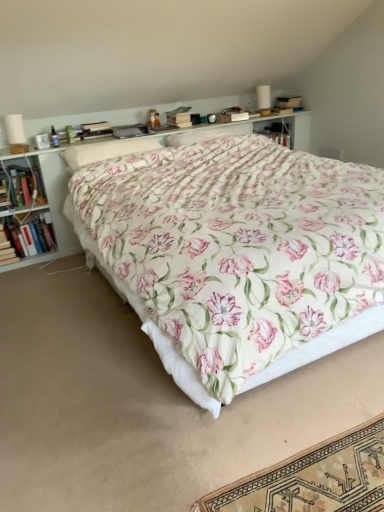
What do you see at coordinates (107, 150) in the screenshot?
I see `floral fabric pillow at center, which ranks as the 1th pillow in left-to-right order` at bounding box center [107, 150].

Identify the location of hardcover book at left, arranged as the second book when viewed from the top. (34, 236).

Image resolution: width=384 pixels, height=512 pixels. What do you see at coordinates (205, 134) in the screenshot?
I see `floral fabric pillow at center, which ranks as the second pillow in left-to-right order` at bounding box center [205, 134].

Find the location of a particular element. The height and width of the screenshot is (512, 384). floral cotton bed at center is located at coordinates (237, 255).

Is hardcover book at left, the 3th book positioned from the bottom, in front of or behind white wood shelf at upper center in the image?

Visually, hardcover book at left, the 3th book positioned from the bottom, is located behind white wood shelf at upper center.

Is point (19, 173) behind point (43, 175)?

No, (19, 173) is closer to viewer.

Who is taller, hardcover book at left, the 3th book positioned from the bottom, or white wood shelf at upper center?

Standing taller between the two is white wood shelf at upper center.

The height and width of the screenshot is (512, 384). What are the coordinates of `shelf on the right of hardcover book at left, which ranks as the first book in top-to-bottom order` in the screenshot? It's located at (54, 206).

In the scene shown: Could you tell me if floral fabric pillow at center, which is the 1th pillow from right to left, is facing hardcover book at left, the 3th book positioned from the bottom?

No, floral fabric pillow at center, which is the 1th pillow from right to left, is not facing towards hardcover book at left, the 3th book positioned from the bottom.

Is there a large distance between floral fabric pillow at center, which is the 1th pillow from right to left, and hardcover book at left, which ranks as the first book in top-to-bottom order?

Absolutely, floral fabric pillow at center, which is the 1th pillow from right to left, is distant from hardcover book at left, which ranks as the first book in top-to-bottom order.

Between floral fabric pillow at center, which ranks as the second pillow in left-to-right order, and hardcover book at left, the 3th book positioned from the bottom, which one is positioned behind?

Positioned behind is floral fabric pillow at center, which ranks as the second pillow in left-to-right order.

Based on their sizes in the image, would you say floral fabric pillow at center, which is the 1th pillow from right to left, is bigger or smaller than hardcover book at left, which ranks as the first book in top-to-bottom order?

In the image, floral fabric pillow at center, which is the 1th pillow from right to left, appears to be larger than hardcover book at left, which ranks as the first book in top-to-bottom order.

Which is further, (10, 250) or (62, 201)?

Point (10, 250)

Would you say hardcover book at left, placed as the 3th book when sorted from top to bottom, contains white wood shelf at upper center?

That's incorrect, white wood shelf at upper center is not inside hardcover book at left, placed as the 3th book when sorted from top to bottom.

Is hardcover book at left, placed as the 3th book when sorted from top to bottom, further to camera compared to white wood shelf at upper center?

That is True.

From a real-world perspective, is hardcover book at left, placed as the 3th book when sorted from top to bottom, physically located above or below white wood shelf at upper center?

From a real-world perspective, hardcover book at left, placed as the 3th book when sorted from top to bottom, is physically below white wood shelf at upper center.

Looking at this image, considering the relative positions of floral cotton bed at center and white wood shelf at upper center in the image provided, is floral cotton bed at center to the right of white wood shelf at upper center from the viewer's perspective?

Correct, you'll find floral cotton bed at center to the right of white wood shelf at upper center.

Considering the sizes of objects floral cotton bed at center and white wood shelf at upper center in the image provided, who is bigger, floral cotton bed at center or white wood shelf at upper center?

Bigger between the two is floral cotton bed at center.

Does floral cotton bed at center come in front of white wood shelf at upper center?

Yes, it is.

From the picture: What's the angular difference between floral cotton bed at center and white wood shelf at upper center's facing directions?

floral cotton bed at center and white wood shelf at upper center are facing 0.000921 degrees away from each other.

Considering the positions of objects floral fabric pillow at center, positioned as the second pillow in right-to-left order, and floral fabric pillow at center, which ranks as the second pillow in left-to-right order, in the image provided, who is in front, floral fabric pillow at center, positioned as the second pillow in right-to-left order, or floral fabric pillow at center, which ranks as the second pillow in left-to-right order,?

floral fabric pillow at center, positioned as the second pillow in right-to-left order.

Does floral fabric pillow at center, which ranks as the 1th pillow in left-to-right order, have a smaller size compared to floral fabric pillow at center, which is the 1th pillow from right to left?

No.

In the scene shown: Does floral fabric pillow at center, which ranks as the 1th pillow in left-to-right order, appear on the left side of floral fabric pillow at center, which ranks as the second pillow in left-to-right order?

Indeed, floral fabric pillow at center, which ranks as the 1th pillow in left-to-right order, is positioned on the left side of floral fabric pillow at center, which ranks as the second pillow in left-to-right order.

Which object is wider, floral fabric pillow at center, which ranks as the 1th pillow in left-to-right order, or floral fabric pillow at center, which is the 1th pillow from right to left?

floral fabric pillow at center, which ranks as the 1th pillow in left-to-right order.

Visually, is hardcover book at left, arranged as the second book when viewed from the top, positioned to the left or to the right of floral fabric pillow at center, positioned as the second pillow in right-to-left order?

Clearly, hardcover book at left, arranged as the second book when viewed from the top, is on the left of floral fabric pillow at center, positioned as the second pillow in right-to-left order, in the image.

Where is `pillow that is the 1st one when counting rightward from the hardcover book at left, arranged as the 2th book when ordered from the bottom`? Image resolution: width=384 pixels, height=512 pixels. pillow that is the 1st one when counting rightward from the hardcover book at left, arranged as the 2th book when ordered from the bottom is located at coordinates (107, 150).

From a real-world perspective, is hardcover book at left, arranged as the second book when viewed from the top, on floral fabric pillow at center, positioned as the second pillow in right-to-left order?

No, from a real-world perspective, hardcover book at left, arranged as the second book when viewed from the top, is not over floral fabric pillow at center, positioned as the second pillow in right-to-left order

Do you think hardcover book at left, which ranks as the first book in top-to-bottom order, is within hardcover book at left, which is counted as the 1th book, starting from the bottom, or outside of it?

hardcover book at left, which ranks as the first book in top-to-bottom order, lies outside hardcover book at left, which is counted as the 1th book, starting from the bottom.

Between hardcover book at left, which ranks as the first book in top-to-bottom order, and hardcover book at left, which is counted as the 1th book, starting from the bottom, which one has more height?

hardcover book at left, which is counted as the 1th book, starting from the bottom, is taller.

From the image's perspective, would you say hardcover book at left, the 3th book positioned from the bottom, is shown under hardcover book at left, which is counted as the 1th book, starting from the bottom?

Incorrect, from the image's perspective, hardcover book at left, the 3th book positioned from the bottom, is higher than hardcover book at left, which is counted as the 1th book, starting from the bottom.

Looking at this image, would you consider hardcover book at left, which ranks as the first book in top-to-bottom order, to be distant from hardcover book at left, which is counted as the 1th book, starting from the bottom?

No, hardcover book at left, which ranks as the first book in top-to-bottom order, is not far away from hardcover book at left, which is counted as the 1th book, starting from the bottom.

The height and width of the screenshot is (512, 384). Identify the location of the 2nd book behind the white wood shelf at upper center, counting from the anchor's position. (23, 185).

Identify the location of the 2nd book counting from the left of the floral fabric pillow at center, which ranks as the second pillow in left-to-right order. This screenshot has height=512, width=384. (23, 185).

Which object lies further to the anchor point floral fabric pillow at center, which ranks as the second pillow in left-to-right order, white wood shelf at upper center or hardcover book at left, which is counted as the 1th book, starting from the bottom?

hardcover book at left, which is counted as the 1th book, starting from the bottom, is positioned further to the anchor floral fabric pillow at center, which ranks as the second pillow in left-to-right order.

Which object lies nearer to the anchor point floral cotton bed at center, hardcover book at left, which ranks as the first book in top-to-bottom order, or hardcover book at left, arranged as the second book when viewed from the top?

hardcover book at left, which ranks as the first book in top-to-bottom order, lies closer to floral cotton bed at center than the other object.

Based on their spatial positions, is hardcover book at left, which is counted as the 1th book, starting from the bottom, or white wood shelf at upper center further from hardcover book at left, the 3th book positioned from the bottom?

Based on the image, hardcover book at left, which is counted as the 1th book, starting from the bottom, appears to be further to hardcover book at left, the 3th book positioned from the bottom.

Estimate the real-world distances between objects in this image. Which object is further from floral cotton bed at center, hardcover book at left, which is counted as the 1th book, starting from the bottom, or floral fabric pillow at center, which is the 1th pillow from right to left?

hardcover book at left, which is counted as the 1th book, starting from the bottom, is further to floral cotton bed at center.

Looking at the image, which one is located further to white wood shelf at upper center, hardcover book at left, arranged as the 2th book when ordered from the bottom, or hardcover book at left, which is counted as the 1th book, starting from the bottom?

hardcover book at left, which is counted as the 1th book, starting from the bottom, lies further to white wood shelf at upper center than the other object.

Estimate the real-world distances between objects in this image. Which object is closer to hardcover book at left, arranged as the 2th book when ordered from the bottom, hardcover book at left, placed as the 3th book when sorted from top to bottom, or white wood shelf at upper center?

Among the two, hardcover book at left, placed as the 3th book when sorted from top to bottom, is located nearer to hardcover book at left, arranged as the 2th book when ordered from the bottom.

From the image, which object appears to be nearer to hardcover book at left, the 3th book positioned from the bottom, hardcover book at left, placed as the 3th book when sorted from top to bottom, or floral fabric pillow at center, positioned as the second pillow in right-to-left order?

The object closer to hardcover book at left, the 3th book positioned from the bottom, is hardcover book at left, placed as the 3th book when sorted from top to bottom.

Looking at the image, which one is located closer to floral fabric pillow at center, positioned as the second pillow in right-to-left order, white wood shelf at upper center or hardcover book at left, arranged as the 2th book when ordered from the bottom?

Based on the image, white wood shelf at upper center appears to be nearer to floral fabric pillow at center, positioned as the second pillow in right-to-left order.

I want to click on pillow between hardcover book at left, the 3th book positioned from the bottom, and white wood shelf at upper center, so [107, 150].

At what (x,y) coordinates should I click in order to perform the action: click on pillow between floral cotton bed at center and floral fabric pillow at center, which is the 1th pillow from right to left, along the z-axis. Please return your answer as a coordinate pair (x, y). Looking at the image, I should click on (107, 150).

Where is `pillow situated between hardcover book at left, which is counted as the 1th book, starting from the bottom, and floral fabric pillow at center, which ranks as the second pillow in left-to-right order, from left to right`? The height and width of the screenshot is (512, 384). pillow situated between hardcover book at left, which is counted as the 1th book, starting from the bottom, and floral fabric pillow at center, which ranks as the second pillow in left-to-right order, from left to right is located at coordinates (107, 150).

Identify the location of book between hardcover book at left, the 3th book positioned from the bottom, and floral fabric pillow at center, which ranks as the 1th pillow in left-to-right order, from left to right. The image size is (384, 512). (34, 236).